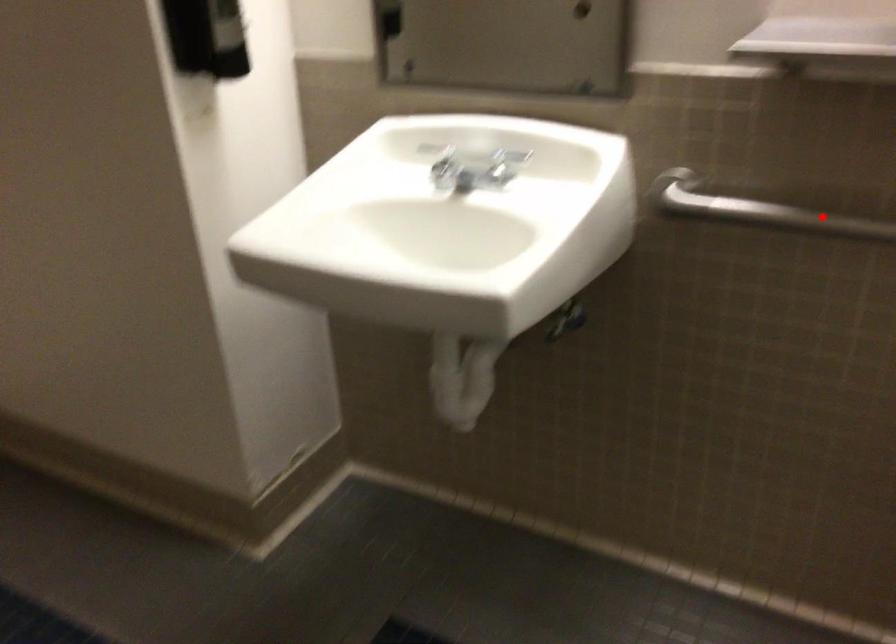
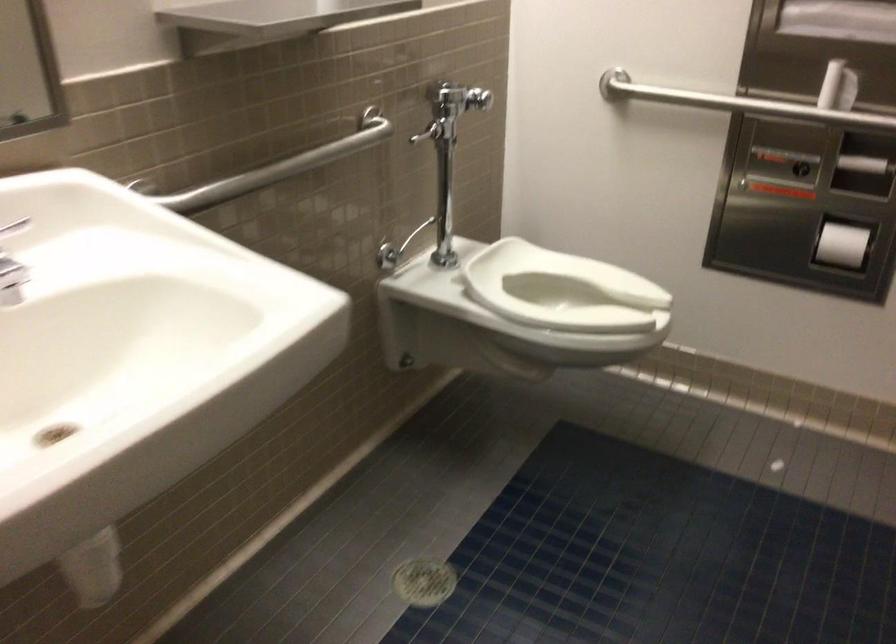
Where in the second image is the point corresponding to the highlighted location from the first image?

(277, 167)